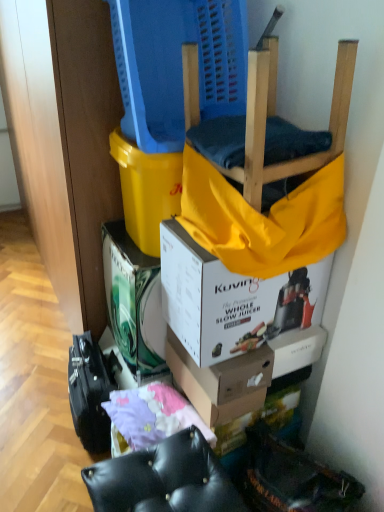
Question: Does yellow fabric at upper center turn towards white cardboard box at center, the first box from the back?

Choices:
 (A) no
 (B) yes

Answer: (A)

Question: Considering the relative positions of yellow fabric at upper center and white cardboard box at center, the first box from the back, in the image provided, is yellow fabric at upper center to the right of white cardboard box at center, the first box from the back, from the viewer's perspective?

Choices:
 (A) yes
 (B) no

Answer: (A)

Question: Is yellow fabric at upper center bigger than white cardboard box at center, the first box from the back?

Choices:
 (A) yes
 (B) no

Answer: (B)

Question: Would you say yellow fabric at upper center is a long distance from white cardboard box at center, arranged as the third box when viewed from the front?

Choices:
 (A) yes
 (B) no

Answer: (B)

Question: Is yellow fabric at upper center wider than white cardboard box at center, the first box from the back?

Choices:
 (A) yes
 (B) no

Answer: (A)

Question: Is yellow fabric at upper center looking in the opposite direction of white cardboard box at center, the first box from the back?

Choices:
 (A) no
 (B) yes

Answer: (A)

Question: Is purple fabric at lower center further to the viewer compared to white cardboard box at center, arranged as the third box when viewed from the front?

Choices:
 (A) yes
 (B) no

Answer: (B)

Question: Can we say purple fabric at lower center lies outside white cardboard box at center, the first box from the back?

Choices:
 (A) yes
 (B) no

Answer: (A)

Question: Can you confirm if purple fabric at lower center is positioned to the right of white cardboard box at center, the first box from the back?

Choices:
 (A) no
 (B) yes

Answer: (B)

Question: Does purple fabric at lower center have a greater height compared to white cardboard box at center, the first box from the back?

Choices:
 (A) no
 (B) yes

Answer: (A)

Question: Is purple fabric at lower center not close to white cardboard box at center, the first box from the back?

Choices:
 (A) no
 (B) yes

Answer: (A)

Question: Can you confirm if purple fabric at lower center is bigger than white cardboard box at center, arranged as the third box when viewed from the front?

Choices:
 (A) no
 (B) yes

Answer: (A)

Question: Can you confirm if white cardboard box at center, arranged as the third box when viewed from the front, is positioned to the right of white cardboard box at upper center, the 3th box viewed from the back?

Choices:
 (A) yes
 (B) no

Answer: (B)